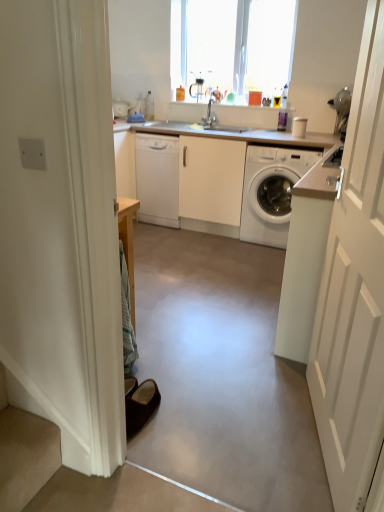
You are a GUI agent. You are given a task and a screenshot of the screen. Output one action in this format:
    pyautogui.click(x=<x>, y=<y>)
    Task: Click on the vacant space in between white wooden door at right and brown suede slippers at lower left
    This screenshot has height=512, width=384.
    Given the screenshot: What is the action you would take?
    pyautogui.click(x=243, y=429)